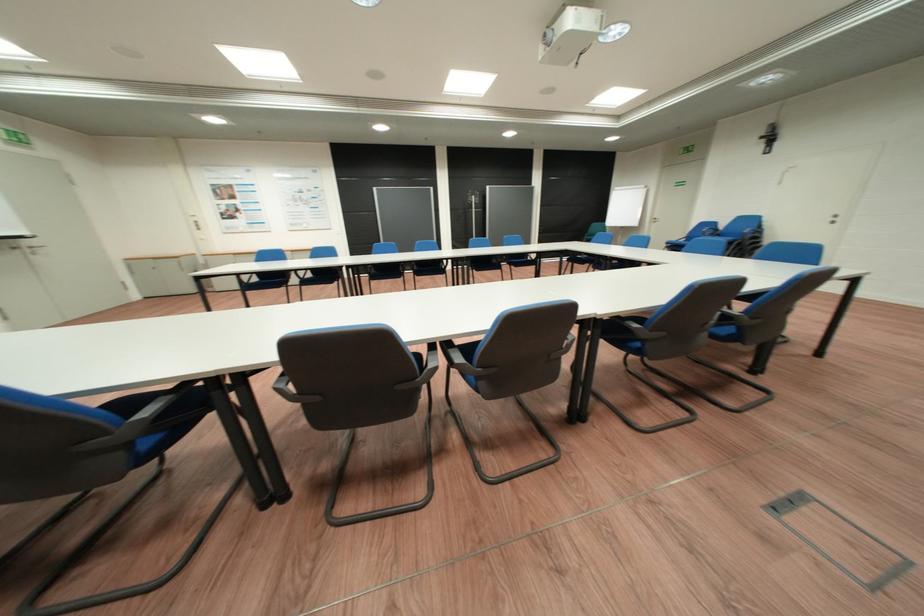
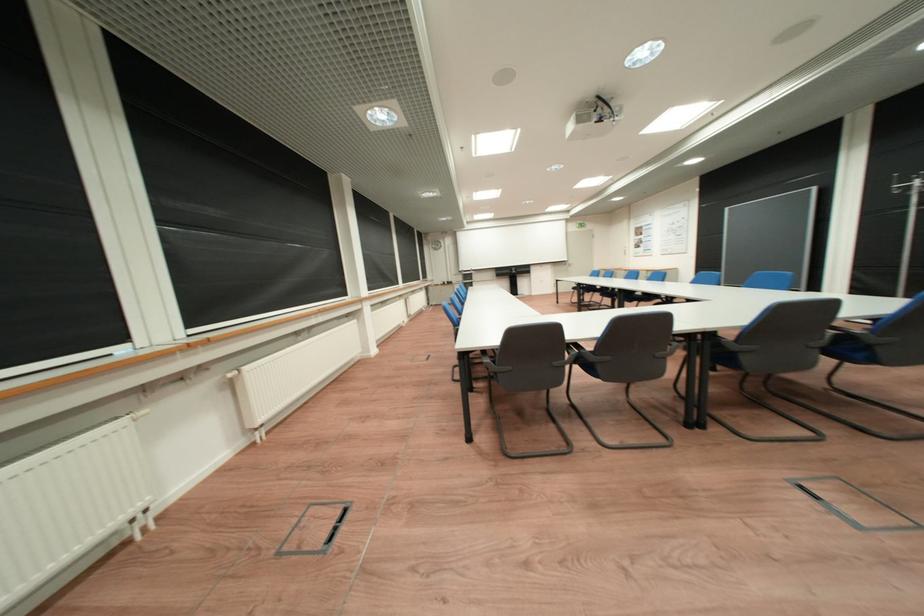
Question: I am providing you with two images of the same scene from different viewpoints. After the viewpoint changes to image2, which objects are now occluded?

Choices:
 (A) grey chair armrest
 (B) floor box handle
 (C) red spine book
 (D) black chair armrest

Answer: (D)